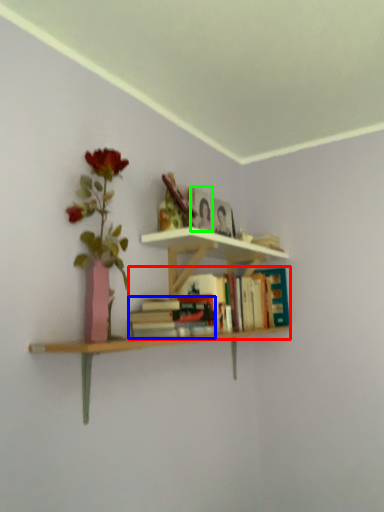
Question: Which object is the farthest from book (highlighted by a red box)? Choose among these: book (highlighted by a blue box) or paperback book (highlighted by a green box).

Choices:
 (A) book
 (B) paperback book

Answer: (B)